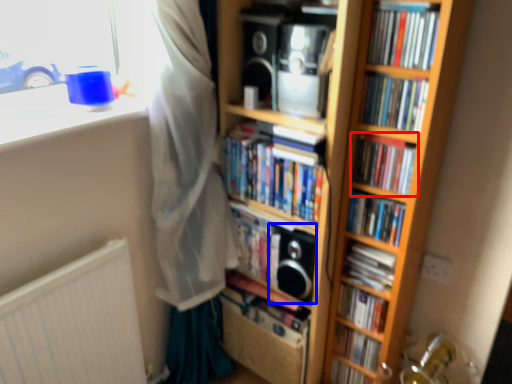
Question: Among these objects, which one is farthest to the camera, book (highlighted by a red box) or speaker (highlighted by a blue box)?

Choices:
 (A) book
 (B) speaker

Answer: (B)